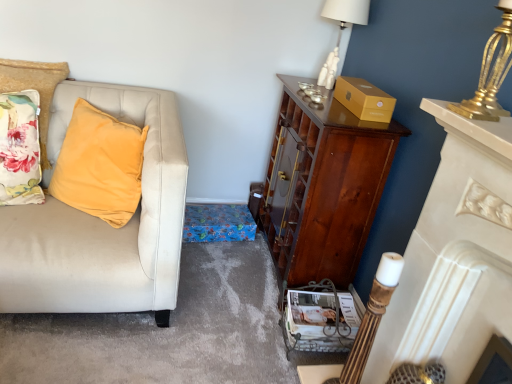
Question: From the image's perspective, is floral fabric pillow at left positioned above or below matte white magazine at lower center?

Choices:
 (A) below
 (B) above

Answer: (B)

Question: Considering their positions, is floral fabric pillow at left located in front of or behind matte white magazine at lower center?

Choices:
 (A) front
 (B) behind

Answer: (B)

Question: Which of these objects is positioned closest to the matte white magazine at lower center?

Choices:
 (A) white glossy fireplace at right
 (B) floral fabric pillow at left
 (C) gold metallic lamp at upper right, placed as the 2th lamp when sorted from left to right
 (D) shiny brown cabinet at right
 (E) gold cardboard box at upper right

Answer: (D)

Question: Which object is positioned closest to the matte white magazine at lower center?

Choices:
 (A) shiny brown cabinet at right
 (B) white glossy fireplace at right
 (C) velvet yellow pillow at left
 (D) floral fabric pillow at left
 (E) gold cardboard box at upper right

Answer: (A)